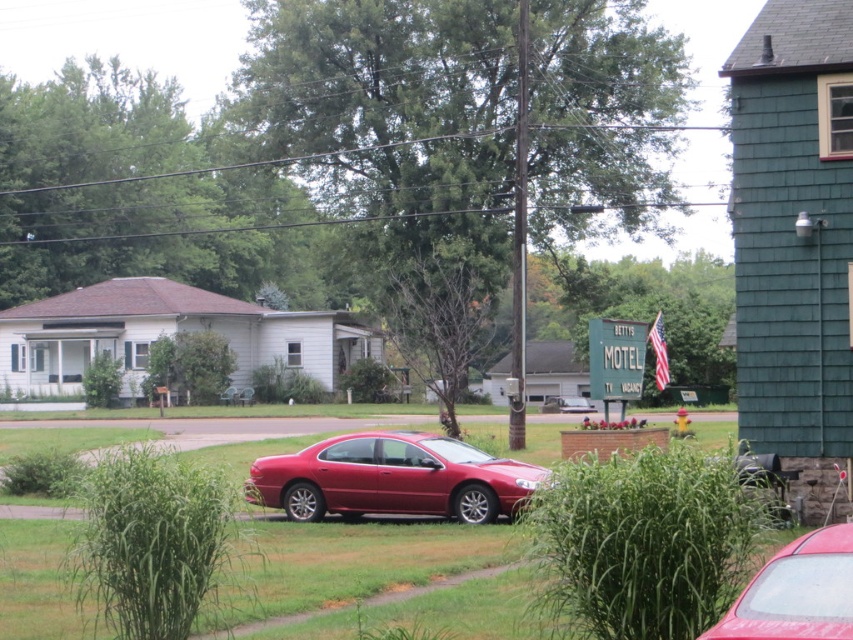
Is glossy red sedan at center positioned behind glossy red car at lower right?

Yes.

Is glossy red sedan at center to the left of glossy red car at lower right from the viewer's perspective?

Indeed, glossy red sedan at center is positioned on the left side of glossy red car at lower right.

What do you see at coordinates (392, 477) in the screenshot? The width and height of the screenshot is (853, 640). I see `glossy red sedan at center` at bounding box center [392, 477].

Find the location of a particular element. This screenshot has height=640, width=853. glossy red sedan at center is located at coordinates (392, 477).

Can you confirm if green grass at center is positioned to the left of glossy red car at lower right?

Correct, you'll find green grass at center to the left of glossy red car at lower right.

Between green grass at center and glossy red car at lower right, which one has less height?

glossy red car at lower right

Is point (393, 573) positioned in front of point (796, 577)?

No, (393, 573) is further to viewer.

Identify the location of green grass at center. Image resolution: width=853 pixels, height=640 pixels. (364, 557).

Does green grass at center have a greater width compared to glossy red sedan at center?

Indeed, green grass at center has a greater width compared to glossy red sedan at center.

Does green grass at center have a lesser height compared to glossy red sedan at center?

No, green grass at center is not shorter than glossy red sedan at center.

Describe the element at coordinates (364, 557) in the screenshot. Image resolution: width=853 pixels, height=640 pixels. I see `green grass at center` at that location.

At what (x,y) coordinates should I click in order to perform the action: click on green grass at center. Please return your answer as a coordinate pair (x, y). This screenshot has width=853, height=640. Looking at the image, I should click on (364, 557).